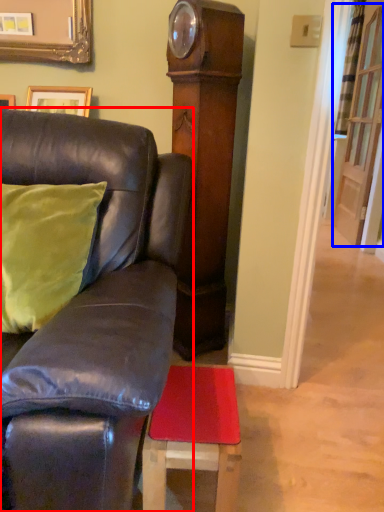
Question: Which object is further to the camera taking this photo, furniture (highlighted by a red box) or glass door (highlighted by a blue box)?

Choices:
 (A) furniture
 (B) glass door

Answer: (B)